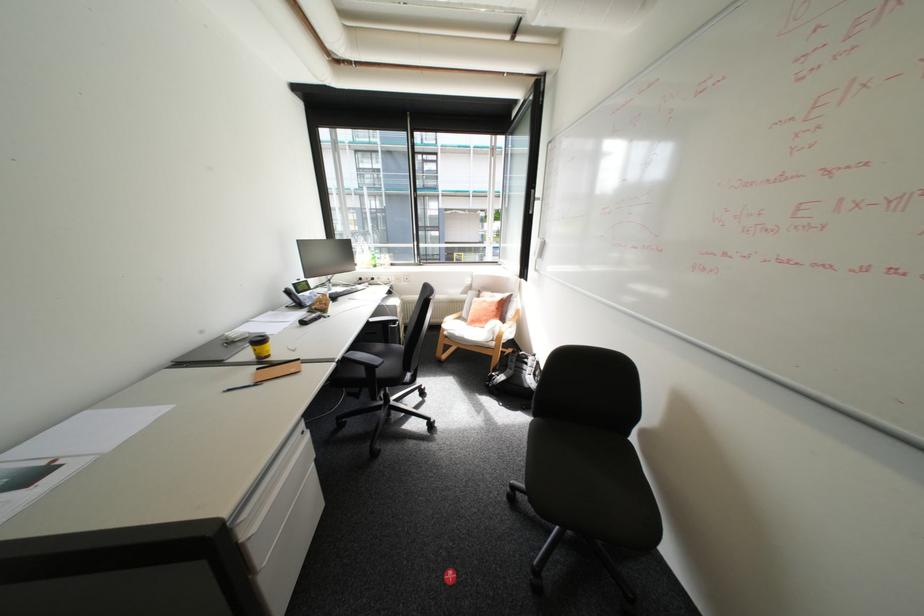
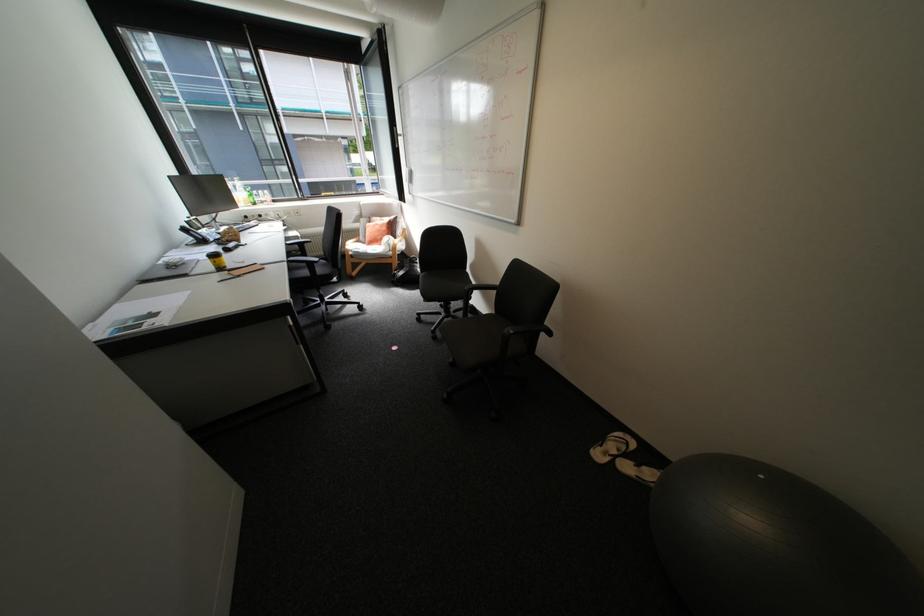
Where in the second image is the point corresponding to point (545, 572) from the first image?

(444, 331)